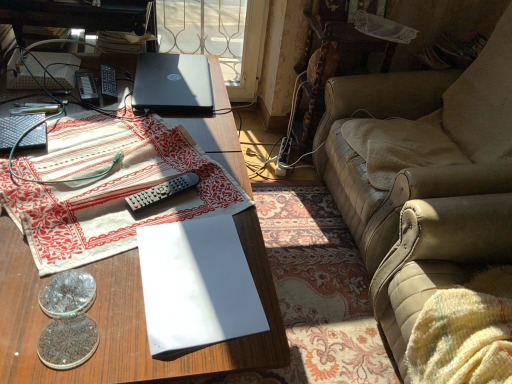
The width and height of the screenshot is (512, 384). What are the coordinates of `black plastic remote control at center, acting as the 2th remote control starting from the right` in the screenshot? It's located at (108, 81).

What do you see at coordinates (125, 320) in the screenshot? I see `wooden desk at center` at bounding box center [125, 320].

What do you see at coordinates (54, 68) in the screenshot?
I see `white paper at left, the second paperback book when ordered from right to left` at bounding box center [54, 68].

The width and height of the screenshot is (512, 384). What do you see at coordinates (197, 285) in the screenshot?
I see `white paper at center, which appears as the first paperback book when ordered from the bottom` at bounding box center [197, 285].

I want to click on white paper at center, which is counted as the second paperback book, starting from the left, so click(x=197, y=285).

The height and width of the screenshot is (384, 512). Describe the element at coordinates (68, 341) in the screenshot. I see `translucent glass coins at lower left, the first coin viewed from the front` at that location.

The height and width of the screenshot is (384, 512). What do you see at coordinates (173, 84) in the screenshot?
I see `satin black laptop at upper center` at bounding box center [173, 84].

Where is `black plastic remote control at center, acting as the 2th remote control starting from the right`? The width and height of the screenshot is (512, 384). black plastic remote control at center, acting as the 2th remote control starting from the right is located at coordinates (108, 81).

Is satin black laptop at upper center further to the viewer compared to wooden desk at center?

Yes, it is.

Which point is more forward, (x=185, y=86) or (x=105, y=360)?

The point (x=105, y=360) is in front.

Is satin black laptop at upper center spatially inside wooden desk at center, or outside of it?

satin black laptop at upper center is not inside wooden desk at center, it's outside.

Considering the sizes of gray plastic remote at center, acting as the first remote control starting from the front, and wooden desk at center in the image, is gray plastic remote at center, acting as the first remote control starting from the front, taller or shorter than wooden desk at center?

Clearly, gray plastic remote at center, acting as the first remote control starting from the front, is shorter compared to wooden desk at center.

Looking at the image, does gray plastic remote at center, which ranks as the first remote control in right-to-left order, seem bigger or smaller compared to wooden desk at center?

In the image, gray plastic remote at center, which ranks as the first remote control in right-to-left order, appears to be smaller than wooden desk at center.

Considering the relative sizes of gray plastic remote at center, the third remote control when ordered from left to right, and wooden desk at center in the image provided, is gray plastic remote at center, the third remote control when ordered from left to right, wider than wooden desk at center?

In fact, gray plastic remote at center, the third remote control when ordered from left to right, might be narrower than wooden desk at center.

Does point (176, 193) come behind point (9, 377)?

Yes, point (176, 193) is behind point (9, 377).

Is lace fabric at upper right at the left side of black plastic remote control at center, the third remote control viewed from the front?

Incorrect, lace fabric at upper right is not on the left side of black plastic remote control at center, the third remote control viewed from the front.

Is the surface of lace fabric at upper right in direct contact with black plastic remote control at center, acting as the 2th remote control starting from the right?

No, lace fabric at upper right is not in contact with black plastic remote control at center, acting as the 2th remote control starting from the right.

Consider the image. Is lace fabric at upper right aimed at black plastic remote control at center, the third remote control viewed from the front?

No, lace fabric at upper right is not oriented towards black plastic remote control at center, the third remote control viewed from the front.

Do you think lace fabric at upper right is within black plastic remote control at center, the first remote control in the top-to-bottom sequence, or outside of it?

lace fabric at upper right is located beyond the bounds of black plastic remote control at center, the first remote control in the top-to-bottom sequence.

Looking at this image, between white paper at left, arranged as the 2th paperback book when viewed from the front, and white paper at center, marked as the first paperback book in a front-to-back arrangement, which one appears on the left side from the viewer's perspective?

white paper at left, arranged as the 2th paperback book when viewed from the front.

Is there a large distance between white paper at left, the second paperback book when ordered from right to left, and white paper at center, which appears as the first paperback book when ordered from the bottom?

They are positioned close to each other.

Can you tell me how much white paper at left, which is the 1th paperback book from top to bottom, and white paper at center, which appears as the first paperback book when ordered from the bottom, differ in facing direction?

They differ by 93.2 degrees in their facing directions.

Would you say white cotton tablecloth at left is to the left or to the right of satin black laptop at upper center in the picture?

From the image, it's evident that white cotton tablecloth at left is to the left of satin black laptop at upper center.

From their relative heights in the image, would you say white cotton tablecloth at left is taller or shorter than satin black laptop at upper center?

Clearly, white cotton tablecloth at left is taller compared to satin black laptop at upper center.

Which is behind, point (55, 158) or point (177, 89)?

The point (177, 89) is farther.

Is white cotton tablecloth at left touching satin black laptop at upper center?

No, white cotton tablecloth at left is not making contact with satin black laptop at upper center.

Is satin black laptop at upper center next to black plastic remote control at center, the third remote control viewed from the front, and touching it?

satin black laptop at upper center is not next to black plastic remote control at center, the third remote control viewed from the front, and they're not touching.

Considering the relative sizes of satin black laptop at upper center and black plastic remote control at center, acting as the 2th remote control starting from the right, in the image provided, is satin black laptop at upper center bigger than black plastic remote control at center, acting as the 2th remote control starting from the right,?

Yes, satin black laptop at upper center is bigger than black plastic remote control at center, acting as the 2th remote control starting from the right.

Is point (185, 78) less distant than point (116, 92)?

No, it is not.

Which object is positioned more to the right, satin black laptop at upper center or black plastic remote control at center, the third remote control viewed from the front?

From the viewer's perspective, satin black laptop at upper center appears more on the right side.

From the image's perspective, which is below, satin black laptop at upper center or translucent glass coins at lower left, the first coin viewed from the front?

From the image's view, translucent glass coins at lower left, the first coin viewed from the front, is below.

Does satin black laptop at upper center have a lesser width compared to translucent glass coins at lower left, which is counted as the 2th coin, starting from the back?

No.

Is satin black laptop at upper center surrounding translucent glass coins at lower left, which is counted as the 2th coin, starting from the back?

Actually, translucent glass coins at lower left, which is counted as the 2th coin, starting from the back, is outside satin black laptop at upper center.

Between satin black laptop at upper center and translucent glass coins at lower left, the first coin viewed from the front, which one has larger size?

satin black laptop at upper center is bigger.

The height and width of the screenshot is (384, 512). I want to click on laptop located above the wooden desk at center (from a real-world perspective), so click(x=173, y=84).

What are the coordinates of `desk on the left of gray plastic remote at center, placed as the first remote control when sorted from bottom to top` in the screenshot? It's located at (125, 320).

Considering their positions, is leather couch at right positioned closer to white paper at left, which is the 1th paperback book from top to bottom, than shiny metallic coin at lower left, placed as the second coin when sorted from front to back?

shiny metallic coin at lower left, placed as the second coin when sorted from front to back.

Which object lies nearer to the anchor point wooden desk at center, white paper at center, which is the first paperback book in right-to-left order, or gray plastic remote at center, which ranks as the first remote control in right-to-left order?

The object closer to wooden desk at center is white paper at center, which is the first paperback book in right-to-left order.

Looking at the image, which one is located further to gray plastic remote at center, the 3th remote control viewed from the back, white paper at left, which is the 1th paperback book from top to bottom, or satin black laptop at upper center?

white paper at left, which is the 1th paperback book from top to bottom, is further to gray plastic remote at center, the 3th remote control viewed from the back.

Looking at the image, which one is located closer to wooden desk at center, black plastic remote control at upper left, acting as the second remote control starting from the back, or white cotton tablecloth at left?

The object closer to wooden desk at center is white cotton tablecloth at left.

Considering their positions, is gray plastic remote at center, the third remote control when ordered from left to right, positioned further to translucent glass coins at lower left, the first coin viewed from the front, than lace fabric at upper right?

lace fabric at upper right lies further to translucent glass coins at lower left, the first coin viewed from the front, than the other object.

Looking at the image, which one is located further to white paper at center, marked as the first paperback book in a front-to-back arrangement, leather couch at right or translucent glass coins at lower left, the first coin viewed from the front?

leather couch at right is further to white paper at center, marked as the first paperback book in a front-to-back arrangement.

Based on their spatial positions, is black plastic remote control at center, acting as the 2th remote control starting from the right, or satin black laptop at upper center closer to black plastic remote control at upper left, positioned as the 2th remote control in front-to-back order?

black plastic remote control at center, acting as the 2th remote control starting from the right.

Based on their spatial positions, is black plastic remote control at center, which appears as the first remote control when viewed from the back, or wooden desk at center closer to white paper at left, the second paperback book when ordered from right to left?

black plastic remote control at center, which appears as the first remote control when viewed from the back, is positioned closer to the anchor white paper at left, the second paperback book when ordered from right to left.

Where is `coin that lies between satin black laptop at upper center and translucent glass coins at lower left, which is counted as the 2th coin, starting from the back, from top to bottom`? coin that lies between satin black laptop at upper center and translucent glass coins at lower left, which is counted as the 2th coin, starting from the back, from top to bottom is located at coordinates (67, 294).

Find the location of a particular element. Image resolution: width=512 pixels, height=384 pixels. paperback book positioned between wooden desk at center and black plastic remote control at upper left, which is the first remote control from left to right, from near to far is located at coordinates (197, 285).

At what (x,y) coordinates should I click in order to perform the action: click on remote control between black plastic remote control at upper left, which is the first remote control from left to right, and satin black laptop at upper center from left to right. Please return your answer as a coordinate pair (x, y). Looking at the image, I should click on (108, 81).

At what (x,y) coordinates should I click in order to perform the action: click on laptop between wooden desk at center and black plastic remote control at center, the first remote control in the top-to-bottom sequence, from front to back. Please return your answer as a coordinate pair (x, y). Looking at the image, I should click on (173, 84).